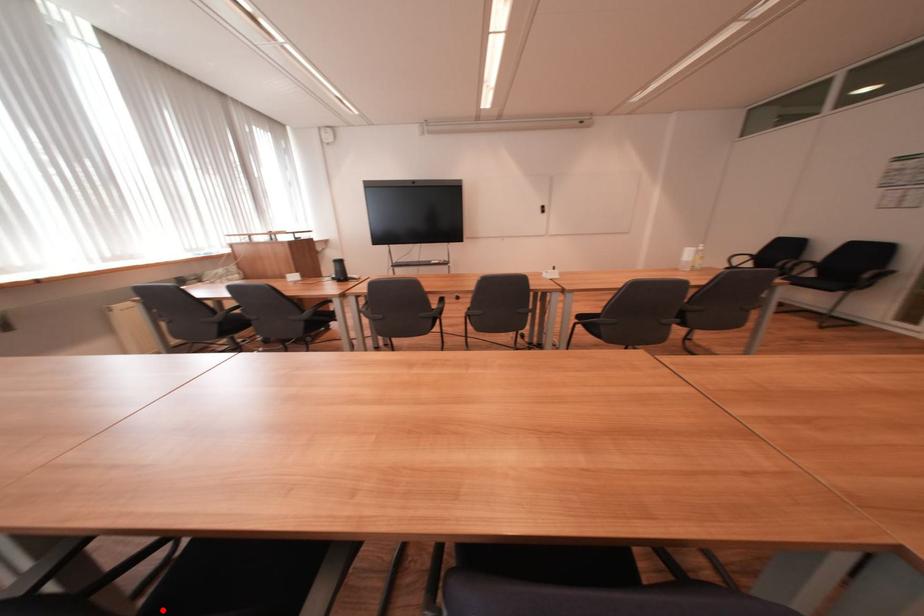
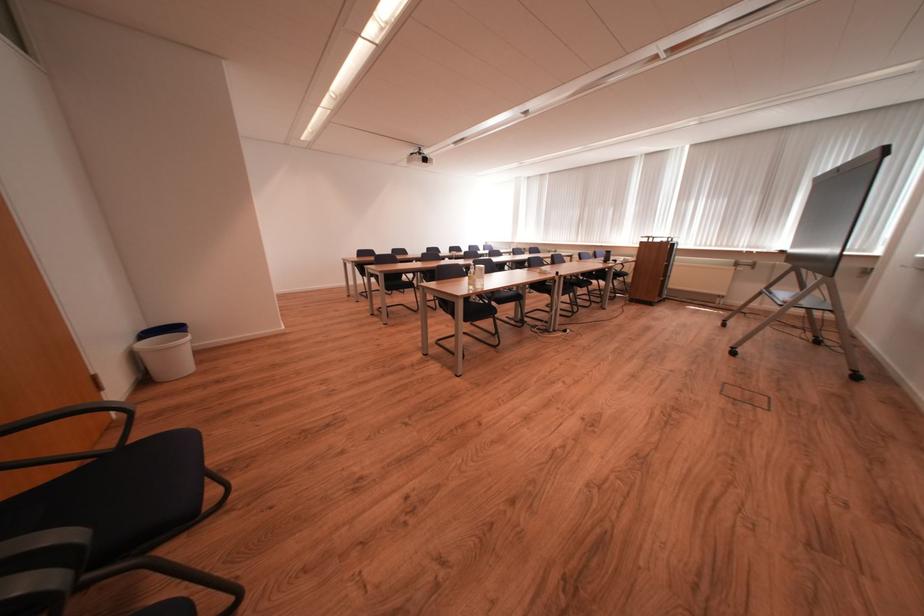
Question: I am providing you with two images of the same scene from different viewpoints. A red point is marked on the first image. At the location where the point appears in image 1, is it still visible in image 2?

Choices:
 (A) Yes
 (B) No

Answer: (B)